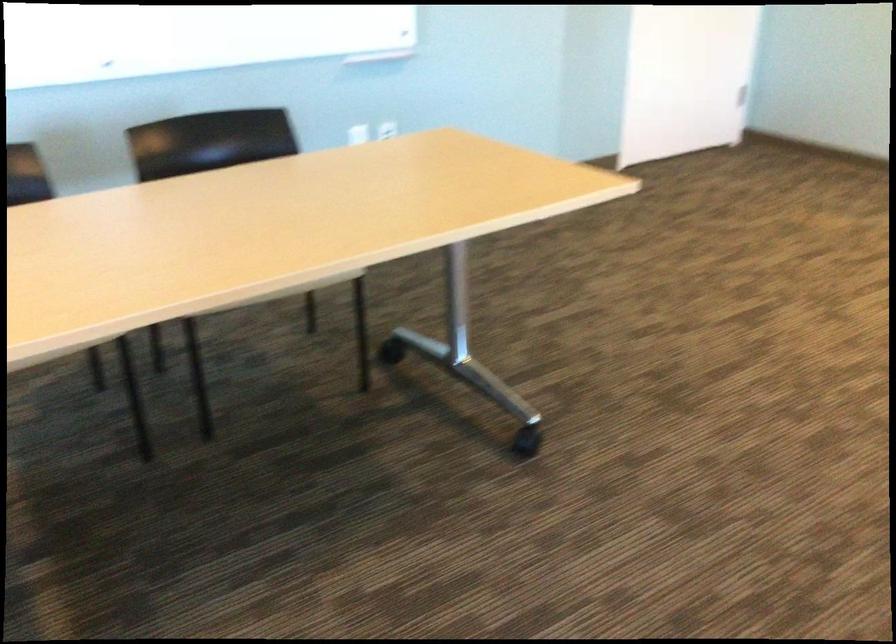
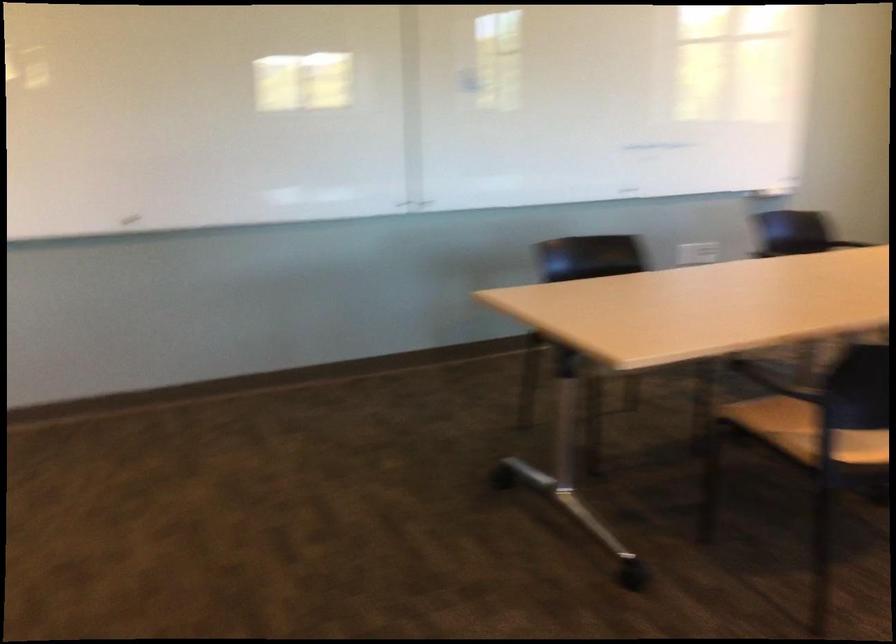
Question: The camera is either moving clockwise (left) or counter-clockwise (right) around the object. The first image is from the beginning of the video and the second image is from the end. Is the camera moving left or right when shooting the video?

Choices:
 (A) Left
 (B) Right

Answer: (A)